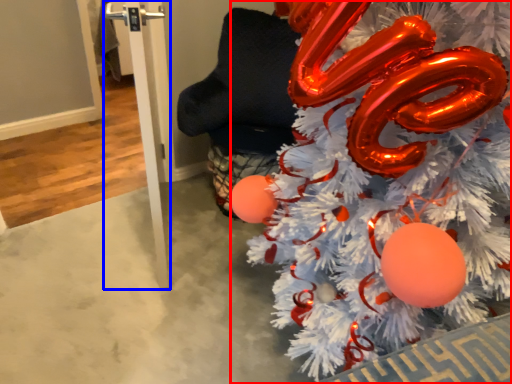
Question: Which object is further to the camera taking this photo, christmas tree (highlighted by a red box) or pole (highlighted by a blue box)?

Choices:
 (A) christmas tree
 (B) pole

Answer: (B)